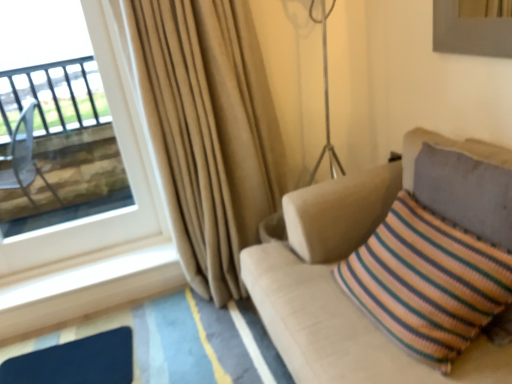
Identify the location of vacant area that is situated to the right of matte blue mat at lower left. (167, 344).